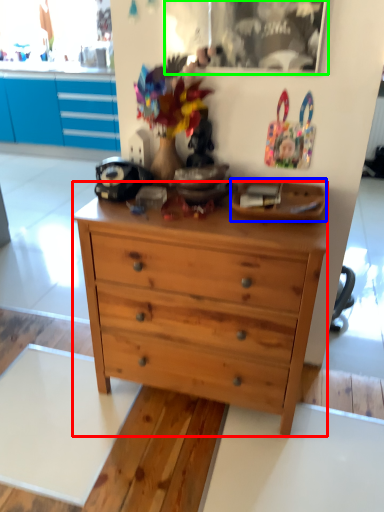
Question: Based on their relative distances, which object is nearer to chest of drawers (highlighted by a red box)? Choose from plate (highlighted by a blue box) and picture frame (highlighted by a green box).

Choices:
 (A) plate
 (B) picture frame

Answer: (A)